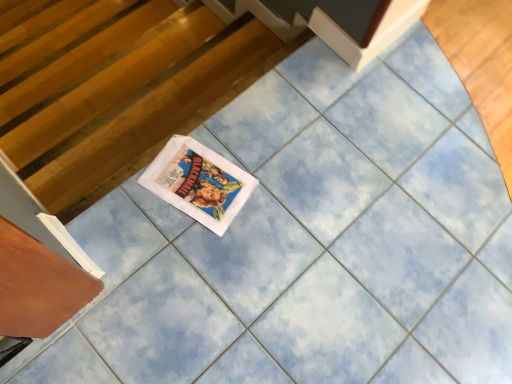
Question: From a real-world perspective, is wooden at left physically above white paper comic book at center?

Choices:
 (A) no
 (B) yes

Answer: (A)

Question: Does wooden at left turn towards white paper comic book at center?

Choices:
 (A) no
 (B) yes

Answer: (A)

Question: Is wooden at left taller than white paper comic book at center?

Choices:
 (A) yes
 (B) no

Answer: (A)

Question: Is wooden at left positioned behind white paper comic book at center?

Choices:
 (A) no
 (B) yes

Answer: (B)

Question: Is wooden at left bigger than white paper comic book at center?

Choices:
 (A) yes
 (B) no

Answer: (A)

Question: Is wooden at left bigger or smaller than wooden drawer at lower left?

Choices:
 (A) small
 (B) big

Answer: (B)

Question: From the image's perspective, is wooden at left located above or below wooden drawer at lower left?

Choices:
 (A) below
 (B) above

Answer: (B)

Question: Is wooden at left taller or shorter than wooden drawer at lower left?

Choices:
 (A) tall
 (B) short

Answer: (B)

Question: Is point (12, 115) positioned closer to the camera than point (64, 299)?

Choices:
 (A) closer
 (B) farther

Answer: (B)

Question: Does point (161, 163) appear closer or farther from the camera than point (208, 36)?

Choices:
 (A) farther
 (B) closer

Answer: (B)

Question: Is white paper comic book at center bigger or smaller than wooden at left?

Choices:
 (A) big
 (B) small

Answer: (B)

Question: Choose the correct answer: Is white paper comic book at center inside wooden at left or outside it?

Choices:
 (A) inside
 (B) outside

Answer: (B)

Question: From a real-world perspective, is white paper comic book at center physically located above or below wooden at left?

Choices:
 (A) above
 (B) below

Answer: (A)

Question: Relative to white paper comic book at center, is wooden drawer at lower left in front or behind?

Choices:
 (A) front
 (B) behind

Answer: (A)

Question: Would you say wooden drawer at lower left is to the left or to the right of white paper comic book at center in the picture?

Choices:
 (A) left
 (B) right

Answer: (A)